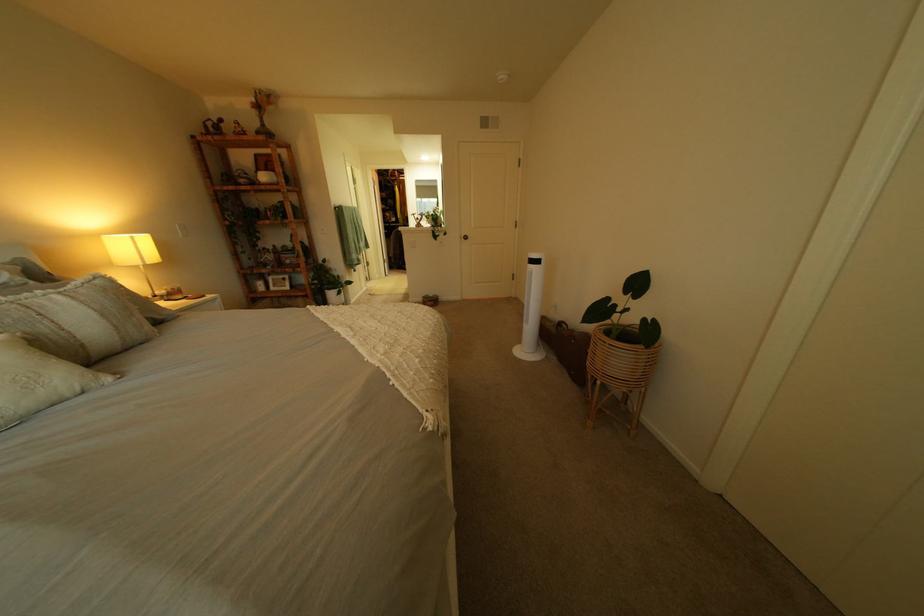
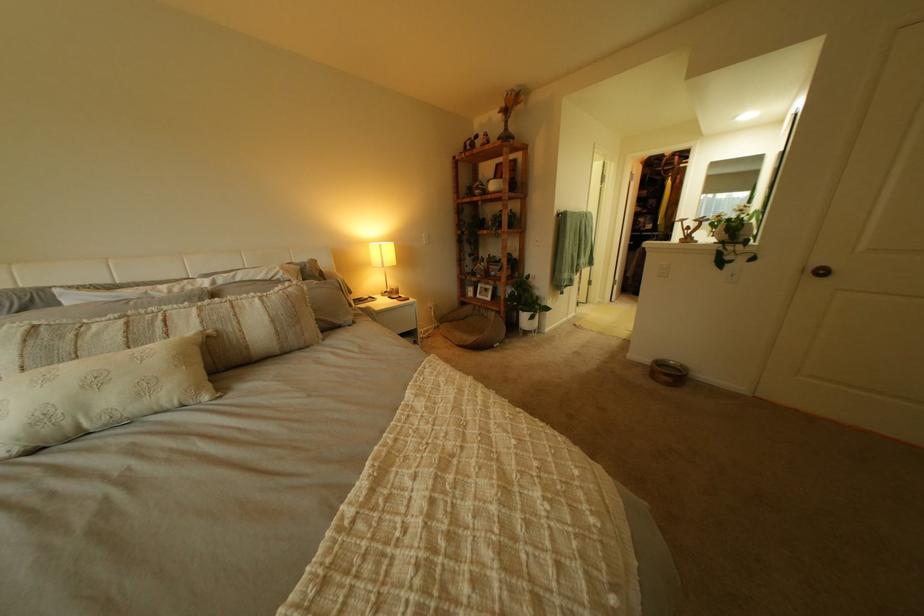
Find the pixel in the second image that matches the point at 324,297 in the first image.

(517, 314)